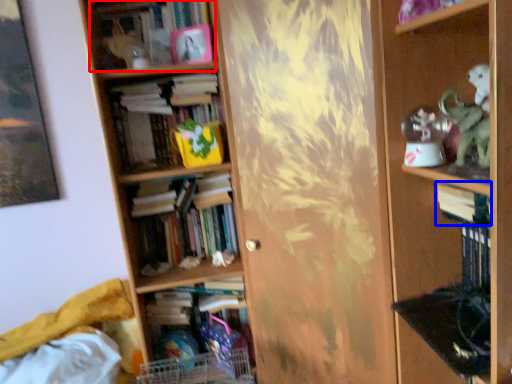
Question: Which object is further to the camera taking this photo, book (highlighted by a red box) or book (highlighted by a blue box)?

Choices:
 (A) book
 (B) book

Answer: (A)